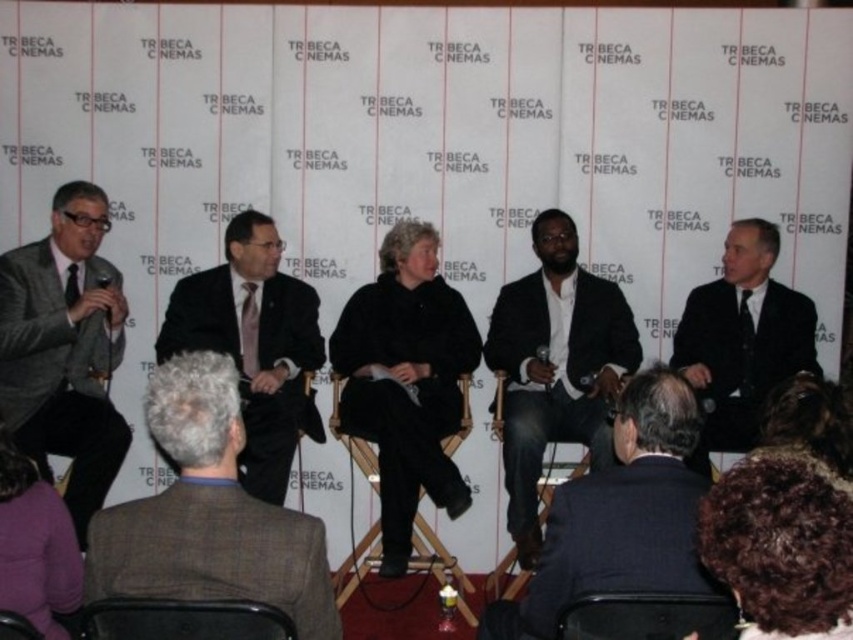
Question: Can you confirm if gray wool suit at center is thinner than dark curly hair at lower right?

Choices:
 (A) yes
 (B) no

Answer: (B)

Question: Is the position of gray wool suit at center less distant than that of dark suit at center?

Choices:
 (A) yes
 (B) no

Answer: (A)

Question: Which point is closer to the camera?

Choices:
 (A) gray wool suit at center
 (B) wooden chair at center
 (C) gray tweed suit at left
 (D) wooden chair at lower left

Answer: (A)

Question: Which object is positioned farthest from the dark curly hair at lower right?

Choices:
 (A) jeans at center
 (B) black leather chair at lower left
 (C) purple fleece jacket at lower left
 (D) black suit at right

Answer: (D)

Question: Estimate the real-world distances between objects in this image. Which object is closer to the wooden chair at lower left?

Choices:
 (A) gray wool suit at center
 (B) black leather chair at lower center
 (C) matte black suit at center
 (D) dark curly hair at lower right

Answer: (A)

Question: Is matte black suit at center behind black plastic microphone at left?

Choices:
 (A) no
 (B) yes

Answer: (A)